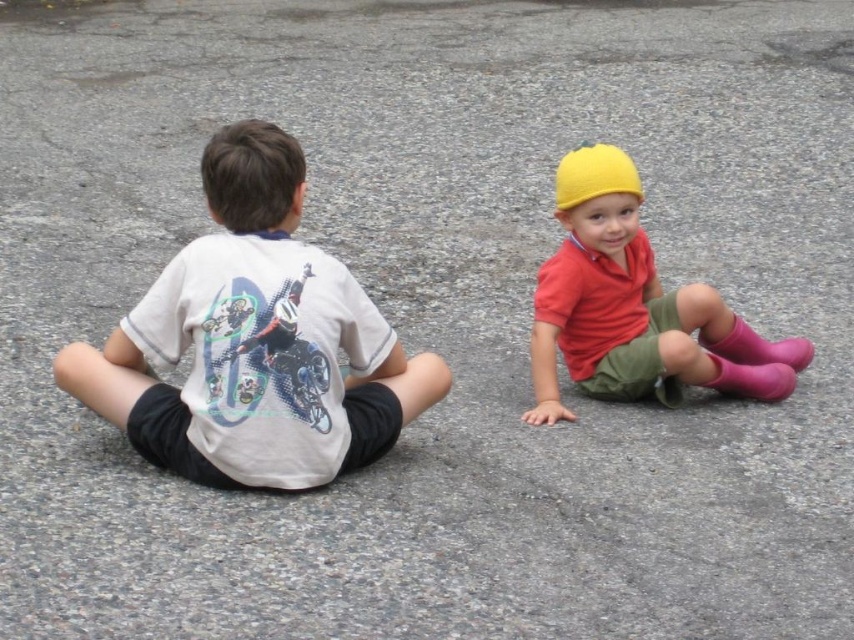
Which is in front, point (642, 348) or point (753, 342)?

Point (642, 348) is more forward.

Describe the element at coordinates (635, 305) in the screenshot. Image resolution: width=854 pixels, height=640 pixels. I see `matte yellow hat at upper right` at that location.

At what (x,y) coordinates should I click in order to perform the action: click on matte yellow hat at upper right. Please return your answer as a coordinate pair (x, y). Looking at the image, I should click on (635, 305).

Is point (603, 157) farther from viewer compared to point (796, 365)?

No, it is not.

Can you confirm if yellow knit hat at upper right is taller than pink rubber boots at lower right?

Yes.

Does point (581, 161) lie behind point (740, 364)?

No, it is not.

At what (x,y) coordinates should I click in order to perform the action: click on yellow knit hat at upper right. Please return your answer as a coordinate pair (x, y). Looking at the image, I should click on point(594,173).

Is white matte t-shirt at left to the right of matte yellow hat at upper right from the viewer's perspective?

Incorrect, white matte t-shirt at left is not on the right side of matte yellow hat at upper right.

Who is more distant from viewer, (425, 368) or (536, 305)?

Point (536, 305)

Is point (214, 301) closer to camera compared to point (597, 353)?

Yes.

You are a GUI agent. You are given a task and a screenshot of the screen. Output one action in this format:
    pyautogui.click(x=<x>, y=<y>)
    Task: Click on the white matte t-shirt at left
    Image resolution: width=854 pixels, height=640 pixels.
    Given the screenshot: What is the action you would take?
    pyautogui.click(x=255, y=342)